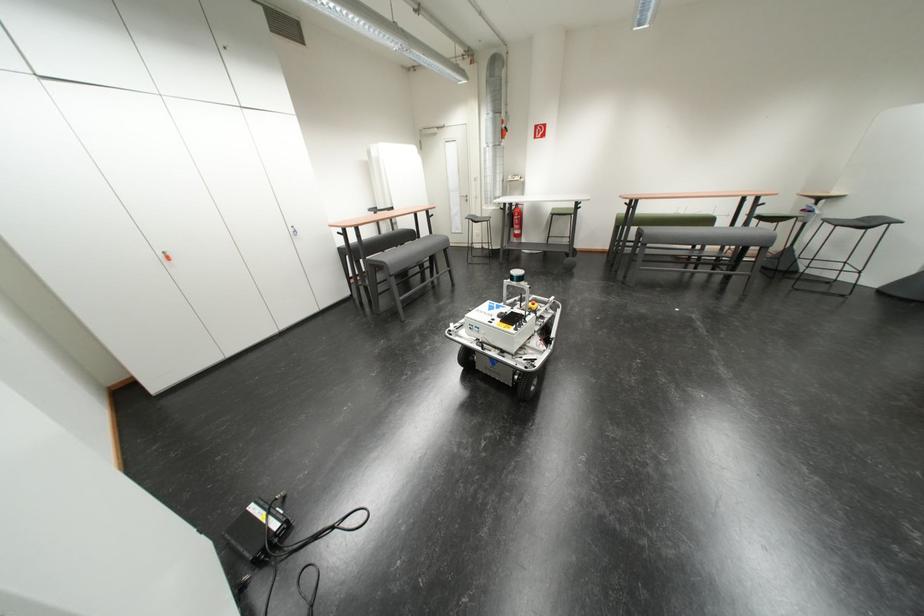
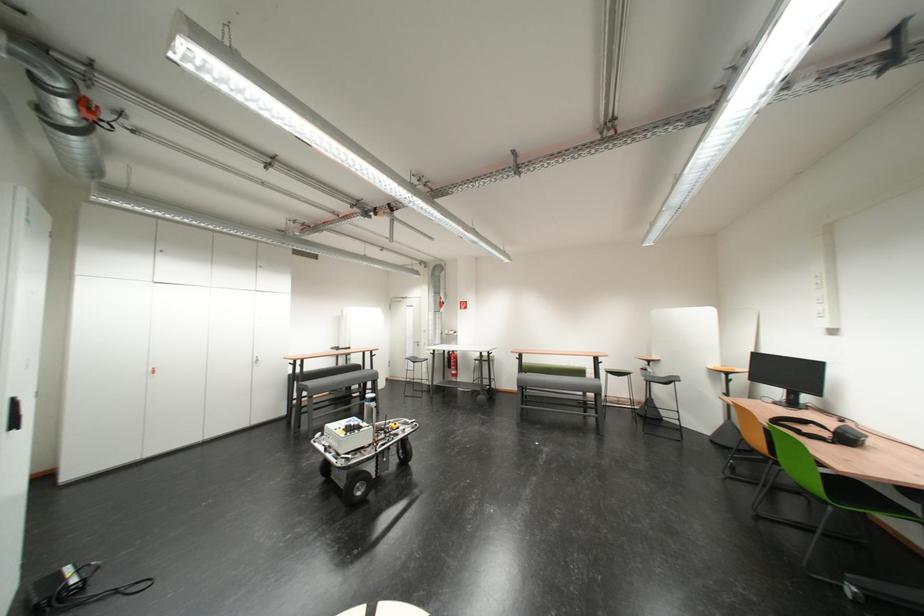
The point at (281, 516) is marked in the first image. Where is the corresponding point in the second image?

(90, 573)